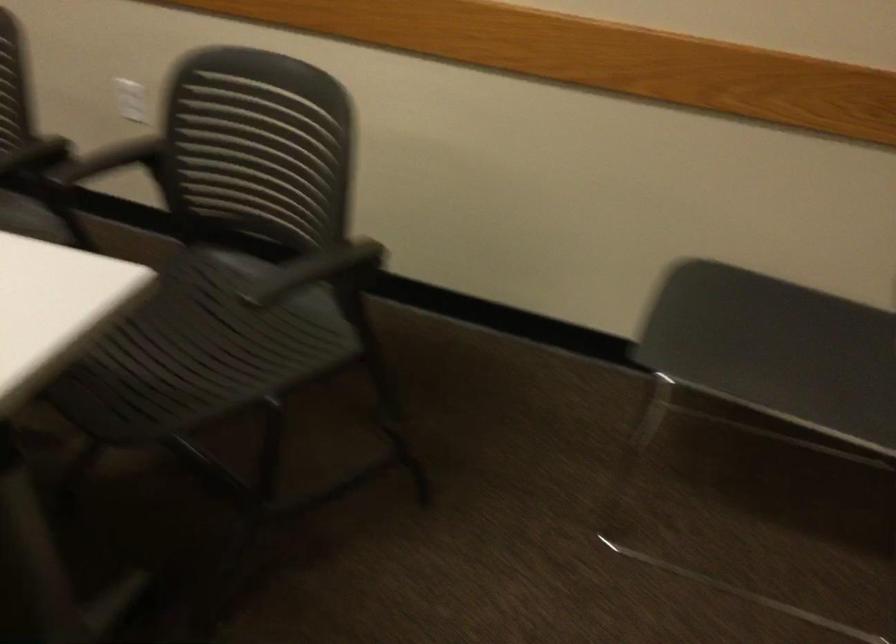
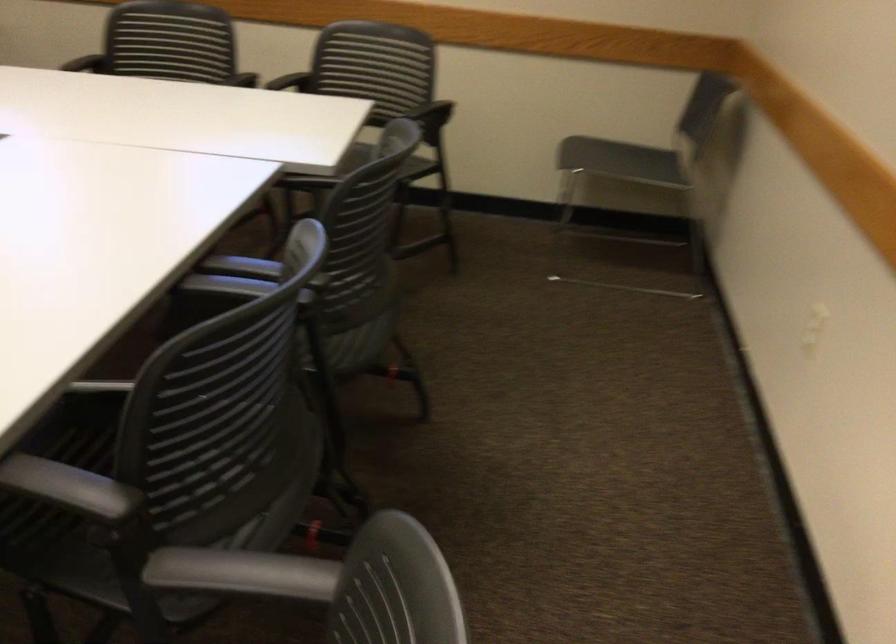
Find the pixel in the second image that matches [268,162] in the first image.

(375, 73)